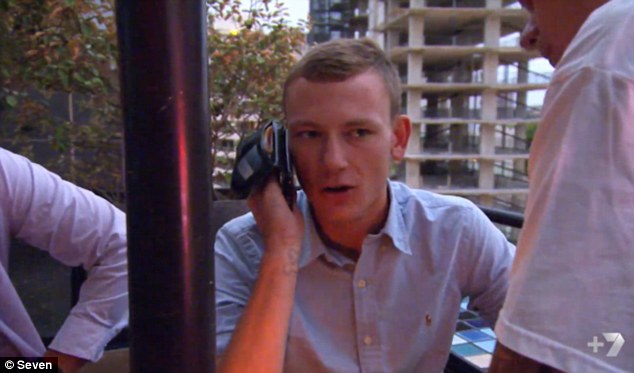
The width and height of the screenshot is (634, 373). I want to click on concrete columns, so click(x=413, y=67), click(x=418, y=29), click(x=495, y=33), click(x=491, y=70), click(x=489, y=107), click(x=415, y=106).